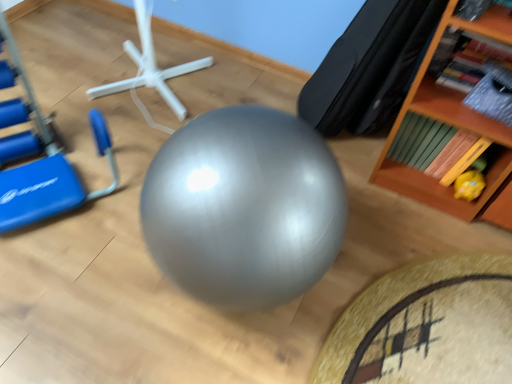
The height and width of the screenshot is (384, 512). Find the location of `unoccupied area in front of blue plastic swivel chair at left`. unoccupied area in front of blue plastic swivel chair at left is located at coordinates (64, 283).